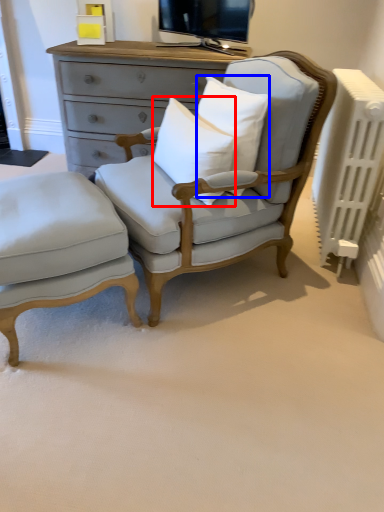
Question: Which point is further to the camera, pillow (highlighted by a red box) or pillow (highlighted by a blue box)?

Choices:
 (A) pillow
 (B) pillow

Answer: (B)